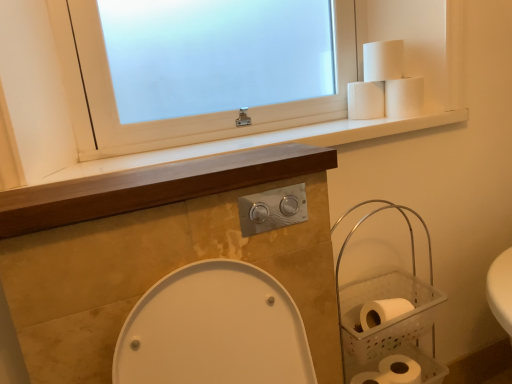
Describe the element at coordinates (153, 186) in the screenshot. This screenshot has height=384, width=512. I see `wooden at center` at that location.

Locate an element on the screen. The image size is (512, 384). wooden at center is located at coordinates click(153, 186).

What do you see at coordinates (187, 116) in the screenshot? This screenshot has height=384, width=512. I see `white frosted glass window at upper center` at bounding box center [187, 116].

Measure the distance between point [429,316] and camera.

3.79 feet.

This screenshot has height=384, width=512. What do you see at coordinates (404, 97) in the screenshot?
I see `white matte toilet paper at upper right, the 2th toilet paper positioned from the bottom` at bounding box center [404, 97].

The image size is (512, 384). What are the coordinates of `white matte toilet paper at upper right, the 2th toilet paper from the top` in the screenshot? It's located at (366, 100).

The height and width of the screenshot is (384, 512). What do you see at coordinates (383, 60) in the screenshot?
I see `white matte toilet paper at upper right, which ranks as the fourth toilet paper in bottom-to-top order` at bounding box center [383, 60].

How much space does white matte toilet paper at lower right, the 4th toilet paper positioned from the top, occupy vertically?

white matte toilet paper at lower right, the 4th toilet paper positioned from the top, is 4.91 inches in height.

What are the coordinates of `wooden at center` in the screenshot? It's located at (153, 186).

From the image's perspective, would you say clear plastic basket at right is positioned over white matte toilet paper at upper right, which is the third toilet paper from bottom to top?

No, from the image's perspective, clear plastic basket at right is not on top of white matte toilet paper at upper right, which is the third toilet paper from bottom to top.

Which object is positioned more to the right, clear plastic basket at right or white matte toilet paper at upper right, which is the third toilet paper from bottom to top?

clear plastic basket at right is more to the right.

Considering the relative sizes of clear plastic basket at right and white matte toilet paper at upper right, the 2th toilet paper from the top, in the image provided, is clear plastic basket at right wider than white matte toilet paper at upper right, the 2th toilet paper from the top,?

Indeed, clear plastic basket at right has a greater width compared to white matte toilet paper at upper right, the 2th toilet paper from the top.

Is there a large distance between clear plastic basket at right and white matte toilet paper at upper right, the 2th toilet paper from the top?

No, there isn't a large distance between clear plastic basket at right and white matte toilet paper at upper right, the 2th toilet paper from the top.

Choose the correct answer: Is white matte toilet paper at upper right, placed as the 1th toilet paper when sorted from top to bottom, inside white matte toilet paper at lower right, the 1th toilet paper in the bottom-to-top sequence, or outside it?

white matte toilet paper at upper right, placed as the 1th toilet paper when sorted from top to bottom, exists outside the volume of white matte toilet paper at lower right, the 1th toilet paper in the bottom-to-top sequence.

Is white matte toilet paper at upper right, placed as the 1th toilet paper when sorted from top to bottom, far from white matte toilet paper at lower right, the 4th toilet paper positioned from the top?

white matte toilet paper at upper right, placed as the 1th toilet paper when sorted from top to bottom, is actually quite close to white matte toilet paper at lower right, the 4th toilet paper positioned from the top.

Is point (377, 74) closer or farther from the camera than point (384, 361)?

Point (377, 74) appears to be farther away from the viewer than point (384, 361).

From a real-world perspective, between white matte toilet paper at upper right, which ranks as the fourth toilet paper in bottom-to-top order, and white matte toilet paper at lower right, the 1th toilet paper in the bottom-to-top sequence, who is vertically lower?

In real-world perspective, white matte toilet paper at lower right, the 1th toilet paper in the bottom-to-top sequence, is lower.

Does white frosted glass window at upper center have a lesser height compared to clear plastic basket at right?

Yes, white frosted glass window at upper center is shorter than clear plastic basket at right.

Can you tell me how much white frosted glass window at upper center and clear plastic basket at right differ in facing direction?

The angular difference between white frosted glass window at upper center and clear plastic basket at right is 0.779 degrees.

Looking at their sizes, would you say white frosted glass window at upper center is wider or thinner than clear plastic basket at right?

In the image, white frosted glass window at upper center appears to be more narrow than clear plastic basket at right.

Is white matte toilet paper at upper right, which is the third toilet paper in top-to-bottom order, positioned with its back to white matte toilet paper at lower right, the 4th toilet paper positioned from the top?

No, white matte toilet paper at upper right, which is the third toilet paper in top-to-bottom order, is not facing away from white matte toilet paper at lower right, the 4th toilet paper positioned from the top.

Is white matte toilet paper at upper right, the 2th toilet paper positioned from the bottom, positioned far away from white matte toilet paper at lower right, the 1th toilet paper in the bottom-to-top sequence?

No.

Between white matte toilet paper at upper right, which is the third toilet paper in top-to-bottom order, and white matte toilet paper at lower right, the 4th toilet paper positioned from the top, which one appears on the right side from the viewer's perspective?

white matte toilet paper at upper right, which is the third toilet paper in top-to-bottom order, is more to the right.

Consider the image. From the image's perspective, which is below, white matte toilet paper at upper right, which is the third toilet paper in top-to-bottom order, or white matte toilet paper at lower right, the 4th toilet paper positioned from the top?

white matte toilet paper at lower right, the 4th toilet paper positioned from the top.

Does white matte toilet paper at lower right, the 1th toilet paper in the bottom-to-top sequence, turn towards white matte toilet paper at upper right, which is the third toilet paper from bottom to top?

No, white matte toilet paper at lower right, the 1th toilet paper in the bottom-to-top sequence, does not turn towards white matte toilet paper at upper right, which is the third toilet paper from bottom to top.

From a real-world perspective, which is physically below, white matte toilet paper at lower right, the 4th toilet paper positioned from the top, or white matte toilet paper at upper right, the 2th toilet paper from the top?

white matte toilet paper at lower right, the 4th toilet paper positioned from the top, is physically lower.

From the image's perspective, relative to clear plastic basket at right, is white matte toilet paper at upper right, which is the third toilet paper in top-to-bottom order, above or below?

Clearly, from the image's perspective, white matte toilet paper at upper right, which is the third toilet paper in top-to-bottom order, is above clear plastic basket at right.

Are white matte toilet paper at upper right, which is the third toilet paper in top-to-bottom order, and clear plastic basket at right making contact?

No, white matte toilet paper at upper right, which is the third toilet paper in top-to-bottom order, is not with clear plastic basket at right.

Between white matte toilet paper at upper right, which is the third toilet paper in top-to-bottom order, and clear plastic basket at right, which one appears on the left side from the viewer's perspective?

clear plastic basket at right is more to the left.

Considering the sizes of objects white matte toilet paper at upper right, which is the third toilet paper in top-to-bottom order, and clear plastic basket at right in the image provided, who is taller, white matte toilet paper at upper right, which is the third toilet paper in top-to-bottom order, or clear plastic basket at right?

clear plastic basket at right is taller.

From the image's perspective, is wooden at center located beneath clear plastic basket at right?

Actually, wooden at center appears above clear plastic basket at right in the image.

Is wooden at center beside clear plastic basket at right?

No, wooden at center is not with clear plastic basket at right.

From the picture: Is wooden at center spatially inside clear plastic basket at right, or outside of it?

wooden at center is outside clear plastic basket at right.

Between wooden at center and clear plastic basket at right, which one has less height?

Standing shorter between the two is wooden at center.

The width and height of the screenshot is (512, 384). Identify the location of basket on the right of white matte toilet paper at upper right, the 2th toilet paper from the top. (387, 316).

Where is `toilet paper that is the 3rd object directly below the white matte toilet paper at upper right, placed as the 1th toilet paper when sorted from top to bottom (from a real-world perspective)`? The height and width of the screenshot is (384, 512). toilet paper that is the 3rd object directly below the white matte toilet paper at upper right, placed as the 1th toilet paper when sorted from top to bottom (from a real-world perspective) is located at coordinates (400, 369).

Based on the photo, estimate the real-world distances between objects in this image. Which object is further from white matte toilet paper at lower right, the 4th toilet paper positioned from the top, clear plastic basket at right or white matte toilet paper at upper right, which ranks as the fourth toilet paper in bottom-to-top order?

The object further to white matte toilet paper at lower right, the 4th toilet paper positioned from the top, is white matte toilet paper at upper right, which ranks as the fourth toilet paper in bottom-to-top order.

From the image, which object appears to be farther from wooden at center, clear plastic basket at right or white matte toilet paper at upper right, which is the third toilet paper in top-to-bottom order?

The object further to wooden at center is white matte toilet paper at upper right, which is the third toilet paper in top-to-bottom order.

From the picture: Based on their spatial positions, is white matte toilet paper at lower right, the 4th toilet paper positioned from the top, or white matte toilet paper at upper right, the 2th toilet paper from the top, further from wooden at center?

white matte toilet paper at lower right, the 4th toilet paper positioned from the top, is further to wooden at center.

Considering their positions, is wooden at center positioned further to white matte toilet paper at upper right, which is the third toilet paper from bottom to top, than clear plastic basket at right?

Among the two, wooden at center is located further to white matte toilet paper at upper right, which is the third toilet paper from bottom to top.

Based on the photo, from the image, which object appears to be farther from white matte toilet paper at lower right, the 4th toilet paper positioned from the top, wooden at center or white frosted glass window at upper center?

Based on the image, white frosted glass window at upper center appears to be further to white matte toilet paper at lower right, the 4th toilet paper positioned from the top.

Based on their spatial positions, is clear plastic basket at right or white matte toilet paper at lower right, the 4th toilet paper positioned from the top, further from white matte toilet paper at upper right, placed as the 1th toilet paper when sorted from top to bottom?

Among the two, white matte toilet paper at lower right, the 4th toilet paper positioned from the top, is located further to white matte toilet paper at upper right, placed as the 1th toilet paper when sorted from top to bottom.

From the image, which object appears to be farther from clear plastic basket at right, wooden at center or white matte toilet paper at lower right, the 1th toilet paper in the bottom-to-top sequence?

wooden at center is positioned further to the anchor clear plastic basket at right.

Based on their spatial positions, is white matte toilet paper at upper right, the 2th toilet paper from the top, or white matte toilet paper at upper right, which is the third toilet paper in top-to-bottom order, further from clear plastic basket at right?

Among the two, white matte toilet paper at upper right, the 2th toilet paper from the top, is located further to clear plastic basket at right.

Where is `counter top between white matte toilet paper at upper right, which is the third toilet paper from bottom to top, and white matte toilet paper at lower right, the 4th toilet paper positioned from the top, in the vertical direction`? counter top between white matte toilet paper at upper right, which is the third toilet paper from bottom to top, and white matte toilet paper at lower right, the 4th toilet paper positioned from the top, in the vertical direction is located at coordinates (153, 186).

Image resolution: width=512 pixels, height=384 pixels. In order to click on basket between wooden at center and white matte toilet paper at upper right, the 2th toilet paper positioned from the bottom in this screenshot , I will do `click(387, 316)`.

Where is `toilet paper between white frosted glass window at upper center and white matte toilet paper at upper right, placed as the 1th toilet paper when sorted from top to bottom, from left to right`? toilet paper between white frosted glass window at upper center and white matte toilet paper at upper right, placed as the 1th toilet paper when sorted from top to bottom, from left to right is located at coordinates (366, 100).

You are a GUI agent. You are given a task and a screenshot of the screen. Output one action in this format:
    pyautogui.click(x=<x>, y=<y>)
    Task: Click on the counter top that lies between white matte toilet paper at upper right, placed as the 1th toilet paper when sorted from top to bottom, and clear plastic basket at right from top to bottom
    
    Given the screenshot: What is the action you would take?
    pyautogui.click(x=153, y=186)